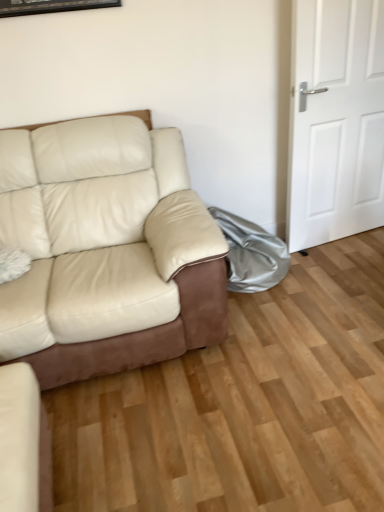
Where is `vacant space in front of silver metallic bag at lower right`? vacant space in front of silver metallic bag at lower right is located at coordinates (284, 311).